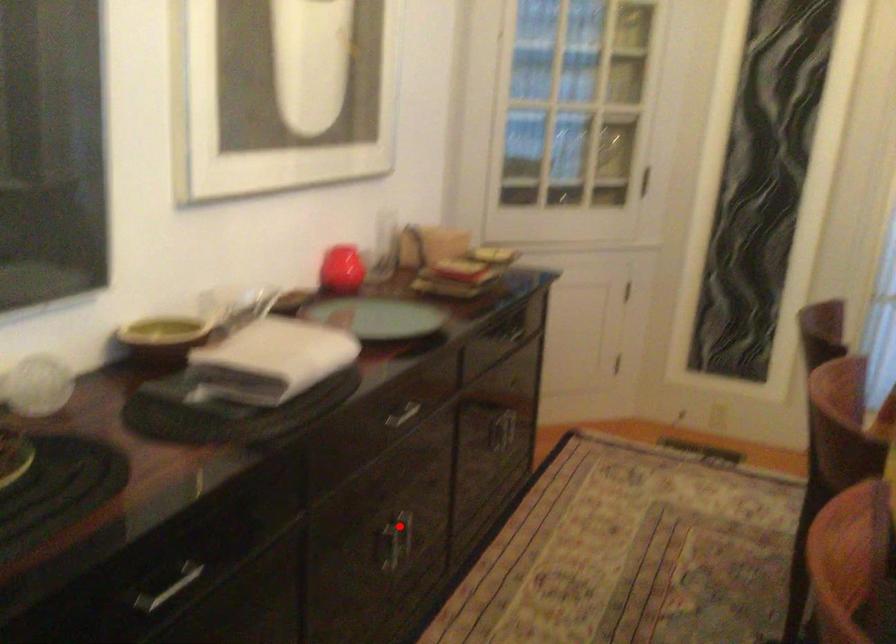
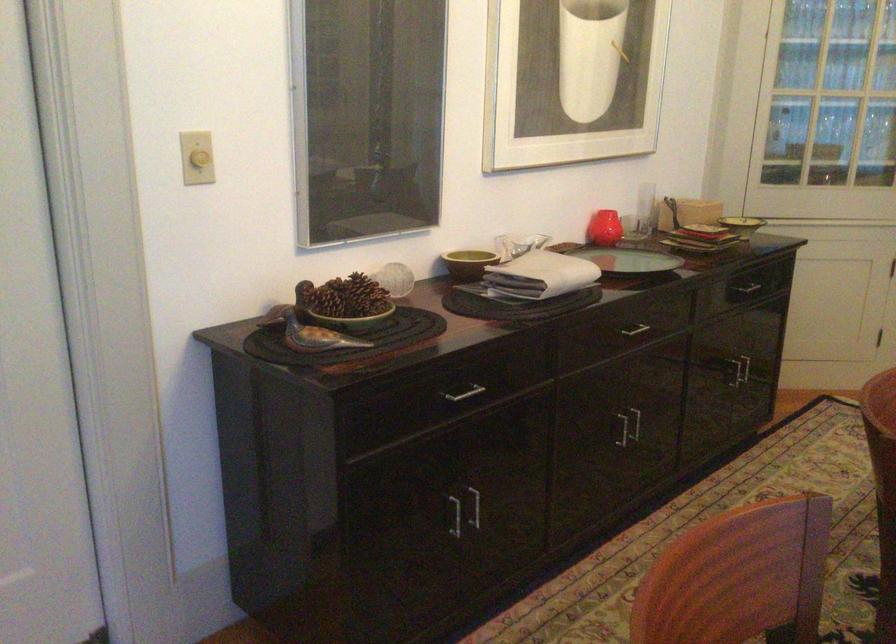
Where in the second image is the point corresponding to the highlighted location from the first image?

(635, 422)